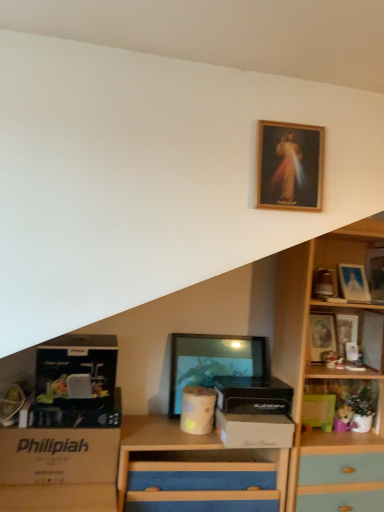
Image resolution: width=384 pixels, height=512 pixels. In order to click on empty space that is ontop of white cardboard box at center, the 1th storage box when ordered from right to left (from a real-world perspective) in this screenshot , I will do `click(257, 409)`.